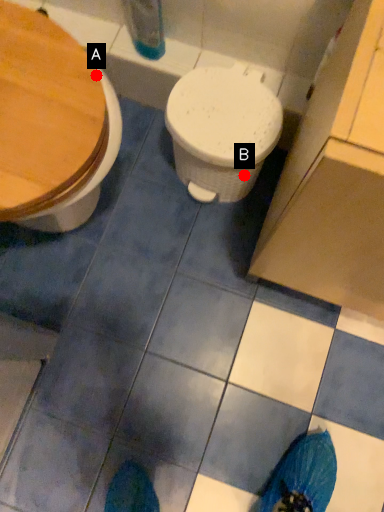
Question: Two points are circled on the image, labeled by A and B beside each circle. Among these points, which one is nearest to the camera?

Choices:
 (A) A is closer
 (B) B is closer

Answer: (A)